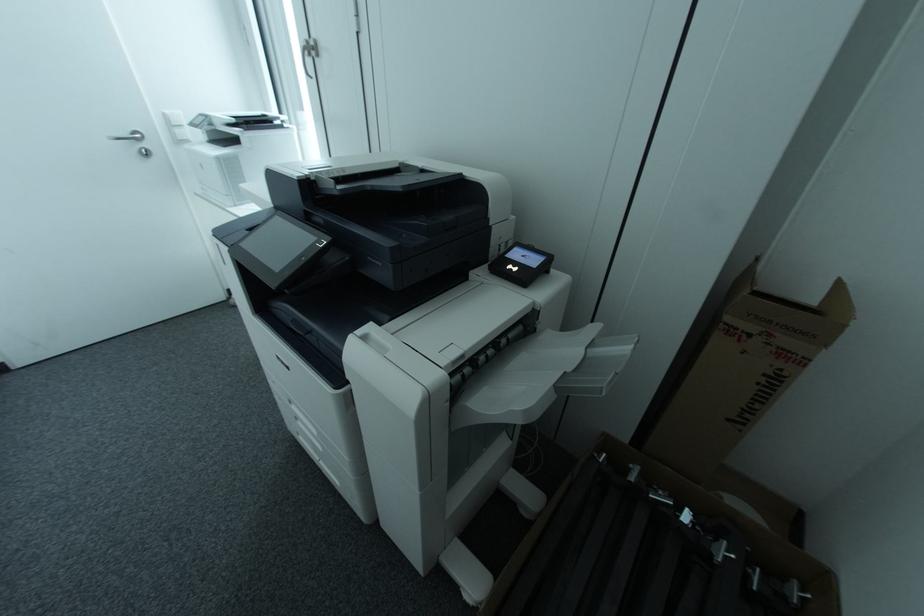
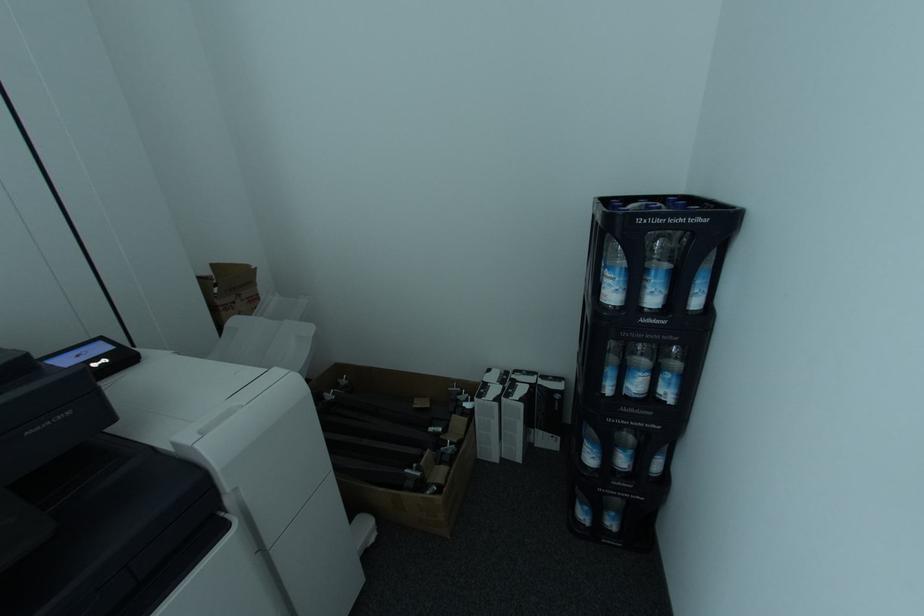
First-person continuous shooting, in which direction is the camera rotating?

The camera's rotation is toward right-down.